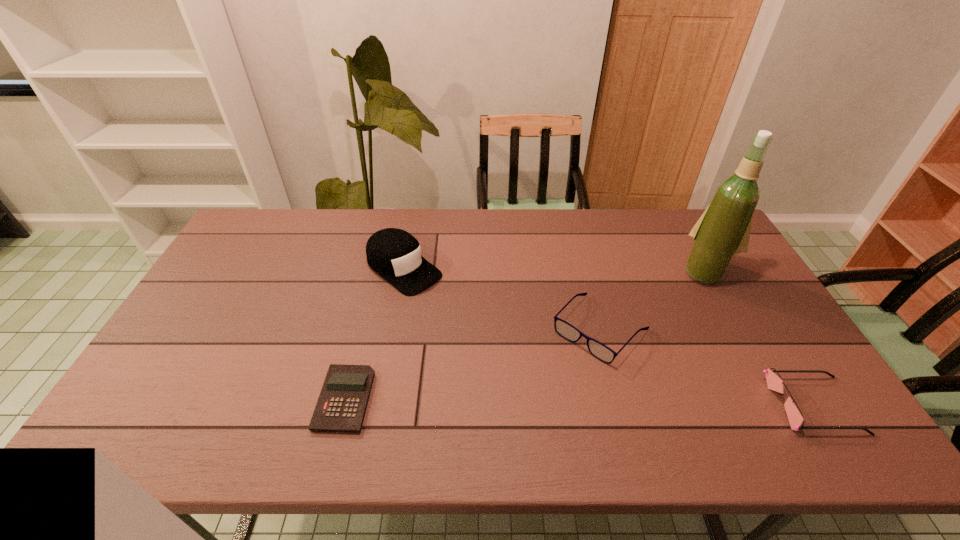
Find the location of `free space between the spectacles and the tallest object`. free space between the spectacles and the tallest object is located at coordinates (653, 300).

You are a GUI agent. You are given a task and a screenshot of the screen. Output one action in this format:
    pyautogui.click(x=<x>, y=<y>)
    Task: Click on the free space between the third object from right to left and the calculator
    The image size is (960, 540).
    Given the screenshot: What is the action you would take?
    pyautogui.click(x=472, y=364)

You are a GUI agent. You are given a task and a screenshot of the screen. Output one action in this format:
    pyautogui.click(x=<x>, y=<y>)
    Task: Click on the unoccupied position between the shortest object and the cap
    
    Given the screenshot: What is the action you would take?
    pyautogui.click(x=374, y=334)

Locate an element on the screen. The height and width of the screenshot is (540, 960). free area in between the third object from right to left and the shortest object is located at coordinates (472, 364).

Find the location of a particular element. free point between the shortest object and the spectacles is located at coordinates (472, 364).

At what (x,y) coordinates should I click in order to perform the action: click on free space between the wine bottle and the second tallest object. Please return your answer as a coordinate pair (x, y). Looking at the image, I should click on (555, 270).

Point out which object is positioned as the third nearest to the tallest object. Please provide its 2D coordinates. Your answer should be formatted as a tuple, i.e. [(x, y)], where the tuple contains the x and y coordinates of a point satisfying the conditions above.

[(394, 254)]

Locate an element on the screen. This screenshot has height=540, width=960. the closest object to the spectacles is located at coordinates (723, 230).

Find the location of a particular element. The height and width of the screenshot is (540, 960). free point that satisfies the following two spatial constraints: 1. on the front side of the sunglasses; 2. on the bridge of the spectacles is located at coordinates (619, 405).

Where is `free space that satisfies the following two spatial constraints: 1. on the front side of the wine bottle; 2. on the right side of the cap`? Image resolution: width=960 pixels, height=540 pixels. free space that satisfies the following two spatial constraints: 1. on the front side of the wine bottle; 2. on the right side of the cap is located at coordinates (403, 271).